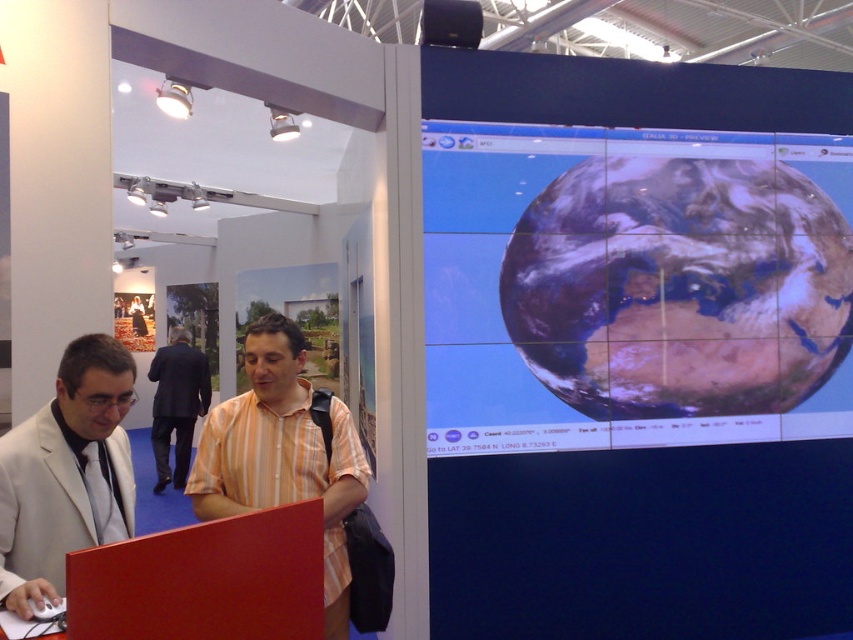
You are attending a trade show and see two presenters. One is wearing a matte white suit at left and the other a dark suit at center. From the perspective of someone standing in front of the display screen, which presenter is positioned to the right of the other?

The matte white suit at left is positioned to the right of the dark suit at center.

Based on the photo, you are at the exhibition and want to touch the smooth glossy earth at right. The point you need to touch is at coordinates point (679,285). Is this point on the smooth glossy earth at right?

Yes, the point (679,285) corresponds to the smooth glossy earth at right, so touching that point will reach the smooth glossy earth at right.

You are attending a trade show and want to locate the presenter wearing the matte white suit at left. According to the coordinates provided, where should you look in the image to find them?

The matte white suit at left is located at the 2D coordinates point [67,474] in the image.